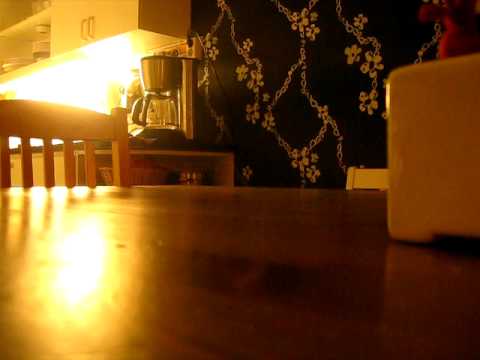
Find the location of a particular element. This screenshot has width=480, height=360. wall is located at coordinates (312, 120).